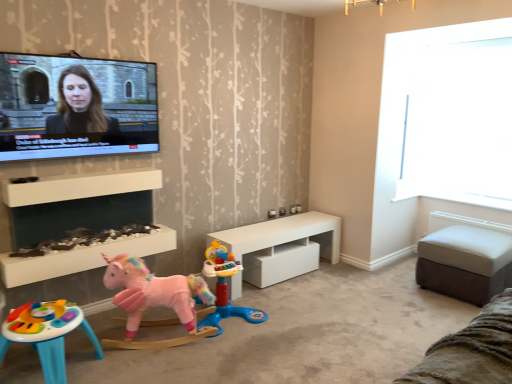
You are a GUI agent. You are given a task and a screenshot of the screen. Output one action in this format:
    pyautogui.click(x=<x>, y=<y>)
    Task: Click on the vacant space positioned to the left of white leather ottoman at right, arranged as the 2th table when viewed from the left
    
    Given the screenshot: What is the action you would take?
    pyautogui.click(x=398, y=288)